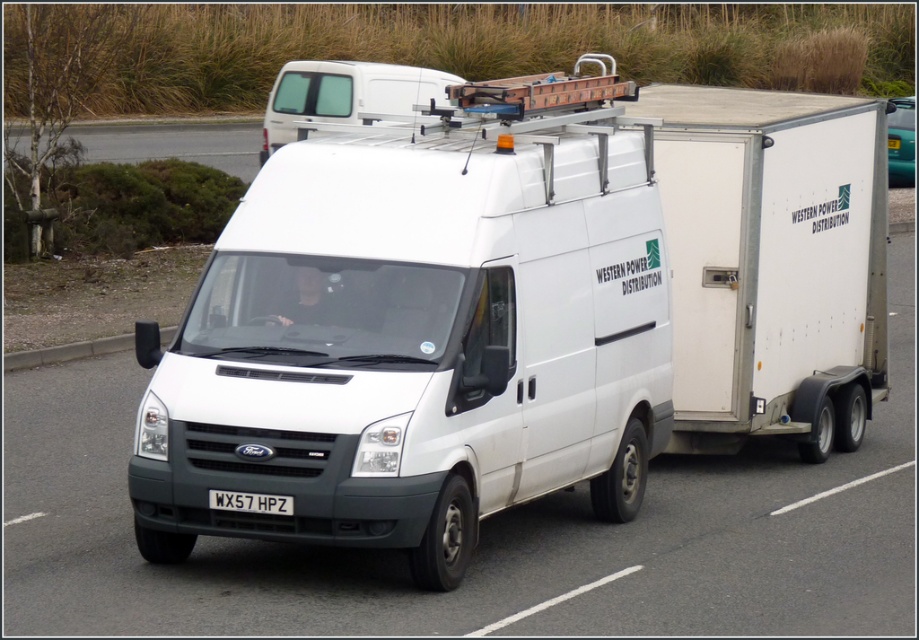
Is point (298, 116) behind point (241, 138)?

No, it is in front of (241, 138).

Does white matte van at upper center appear on the left side of asphalt road at upper center?

Incorrect, white matte van at upper center is not on the left side of asphalt road at upper center.

Between point (303, 65) and point (93, 131), which one is positioned in front?

Positioned in front is point (303, 65).

Locate an element on the screen. This screenshot has height=640, width=919. white matte van at upper center is located at coordinates (345, 93).

Looking at this image, does white matte van at center appear under white plastic license plate at center?

Incorrect, white matte van at center is not positioned below white plastic license plate at center.

Which of these two, white matte van at center or white plastic license plate at center, stands shorter?

With less height is white plastic license plate at center.

You are a GUI agent. You are given a task and a screenshot of the screen. Output one action in this format:
    pyautogui.click(x=<x>, y=<y>)
    Task: Click on the white matte van at center
    This screenshot has width=919, height=640.
    Given the screenshot: What is the action you would take?
    (420, 332)

Which is in front, point (513, 323) or point (290, 65)?

Point (513, 323)

Between white matte van at center and white matte van at upper center, which one appears on the right side from the viewer's perspective?

white matte van at center

Locate an element on the screen. white matte van at center is located at coordinates (420, 332).